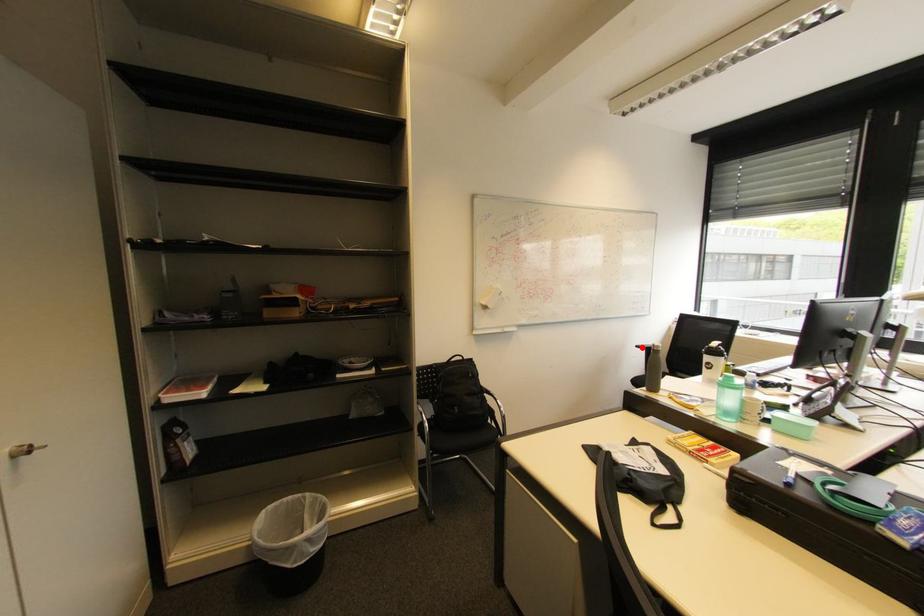
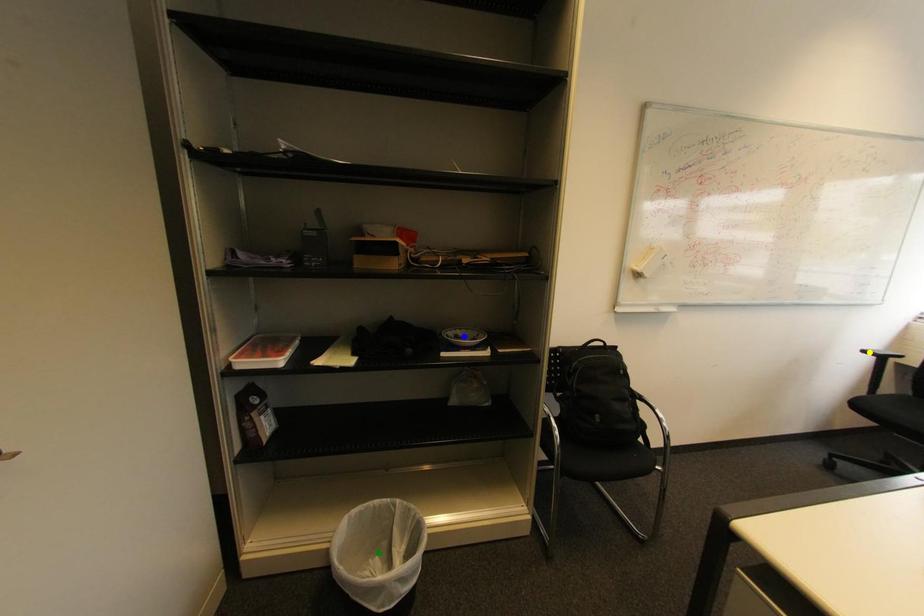
Question: I am providing you with two images of the same scene from different viewpoints. A red point is marked on the first image. You are given multiple points on the second image. In image 2, which mark is for the same physical point as the one in image 1?

Choices:
 (A) green point
 (B) blue point
 (C) yellow point

Answer: (C)